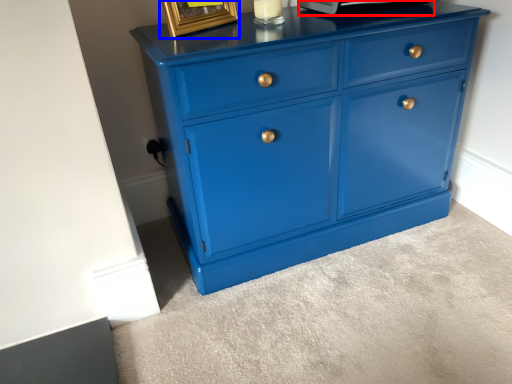
Question: Which point is closer to the camera, appliance (highlighted by a red box) or picture frame (highlighted by a blue box)?

Choices:
 (A) appliance
 (B) picture frame

Answer: (B)